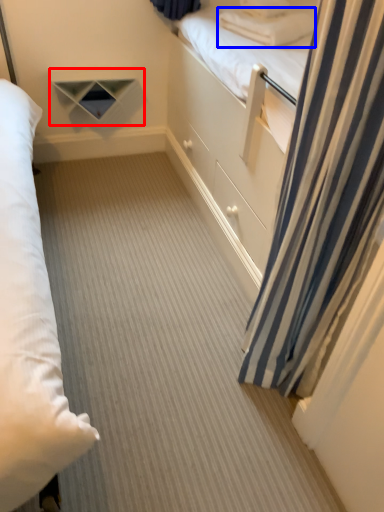
Question: Among these objects, which one is farthest to the camera, shelf (highlighted by a red box) or pillow (highlighted by a blue box)?

Choices:
 (A) shelf
 (B) pillow

Answer: (A)